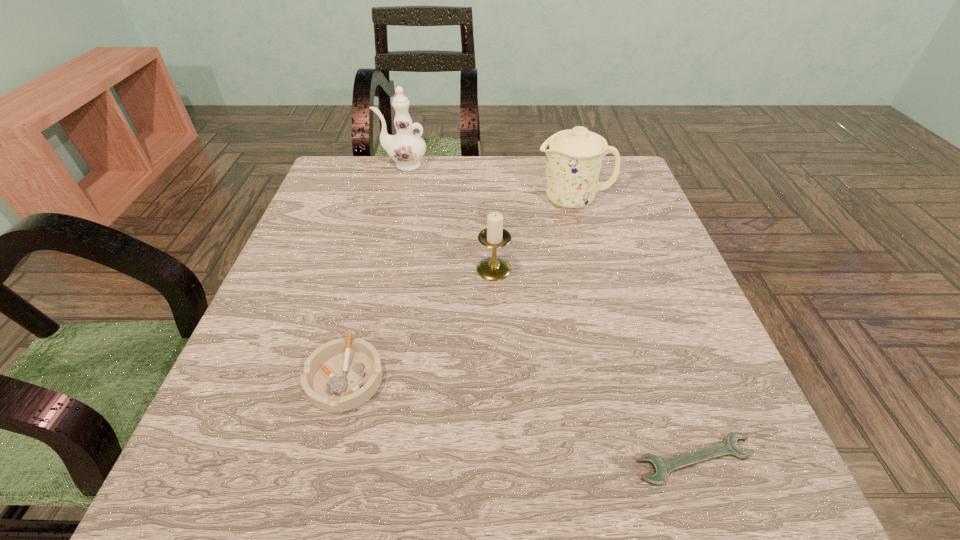
Identify the location of unoccupied area between the shortest object and the second shortest object. (520, 418).

Where is `free space that is in between the fourth nearest object and the ashtray`? The image size is (960, 540). free space that is in between the fourth nearest object and the ashtray is located at coordinates (460, 288).

This screenshot has height=540, width=960. In order to click on empty space that is in between the second farthest object and the third tallest object in this screenshot , I will do `click(534, 234)`.

What are the coordinates of `unoccupied position between the fourth nearest object and the farthest object` in the screenshot? It's located at (489, 183).

Locate which object ranks in proximity to the farther chinaware. Please provide its 2D coordinates. Your answer should be formatted as a tuple, i.e. [(x, y)], where the tuple contains the x and y coordinates of a point satisfying the conditions above.

[(573, 157)]

Identify the location of the third closest object to the left chinaware. (340, 375).

Locate an element on the screen. The height and width of the screenshot is (540, 960). vacant space that satisfies the following two spatial constraints: 1. at the spout of the farthest object; 2. on the right side of the third tallest object is located at coordinates (377, 269).

Where is `vacant position in the image that satisfies the following two spatial constraints: 1. on the front side of the wrench; 2. on the left side of the second nearest object`? Image resolution: width=960 pixels, height=540 pixels. vacant position in the image that satisfies the following two spatial constraints: 1. on the front side of the wrench; 2. on the left side of the second nearest object is located at coordinates (324, 460).

The width and height of the screenshot is (960, 540). Identify the location of vacant space that satisfies the following two spatial constraints: 1. on the back side of the nearest object; 2. on the spout of the right chinaware. (603, 200).

You are a GUI agent. You are given a task and a screenshot of the screen. Output one action in this format:
    pyautogui.click(x=<x>, y=<y>)
    Task: Click on the vacant space that satisfies the following two spatial constraints: 1. at the spout of the shortest object; 2. on the left side of the left chinaware
    
    Given the screenshot: What is the action you would take?
    pyautogui.click(x=331, y=460)